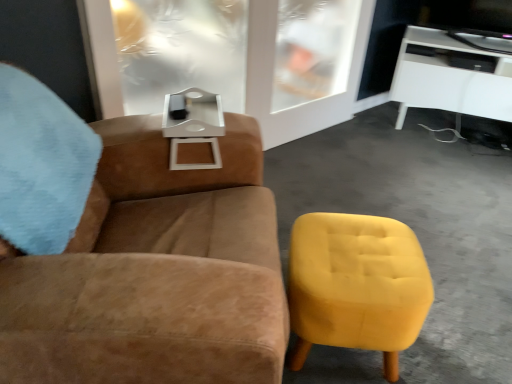
Where is `vacant space situated on the left part of white glossy tv stand at upper right`? vacant space situated on the left part of white glossy tv stand at upper right is located at coordinates (373, 144).